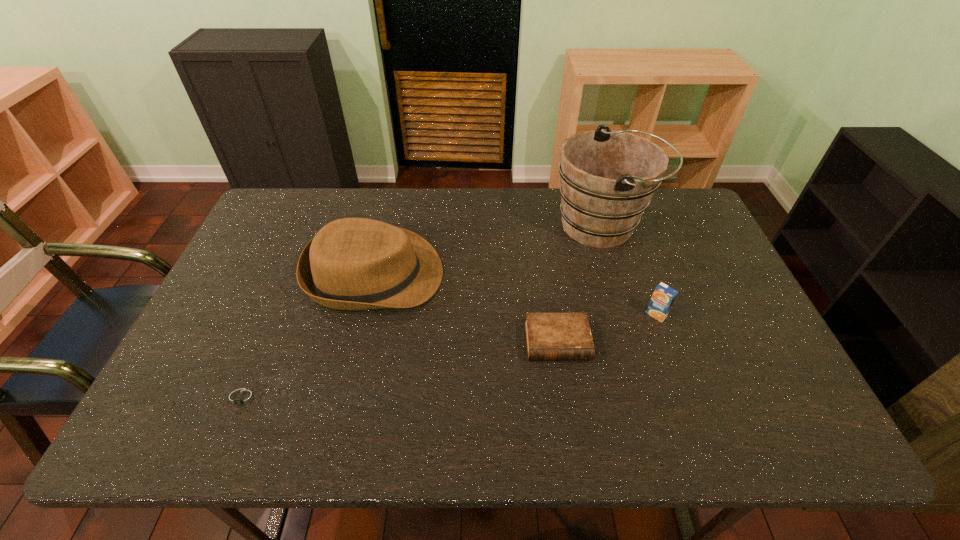
Find the location of `free space between the bucket and the diary`. free space between the bucket and the diary is located at coordinates (580, 284).

Locate an element on the screen. unoccupied position between the orange_juice and the diary is located at coordinates (607, 328).

The width and height of the screenshot is (960, 540). I want to click on blank region between the orange_juice and the fourth shortest object, so click(x=516, y=294).

Locate an element on the screen. Image resolution: width=960 pixels, height=540 pixels. unoccupied position between the diary and the second tallest object is located at coordinates 466,308.

You are a GUI agent. You are given a task and a screenshot of the screen. Output one action in this format:
    pyautogui.click(x=<x>, y=<y>)
    Task: Click on the vacant space in between the diary and the shortest object
    Image resolution: width=960 pixels, height=540 pixels.
    Given the screenshot: What is the action you would take?
    pyautogui.click(x=400, y=370)

At what (x,y) coordinates should I click in order to perform the action: click on the third closest object to the second nearest object. Please return your answer as a coordinate pair (x, y). The width and height of the screenshot is (960, 540). Looking at the image, I should click on (608, 177).

The image size is (960, 540). I want to click on object that stands as the fourth closest to the orange_juice, so click(x=242, y=399).

Where is `free space that satisfies the following two spatial constraints: 1. on the handle side of the tallest object; 2. on the spine side of the second nearest object`? The image size is (960, 540). free space that satisfies the following two spatial constraints: 1. on the handle side of the tallest object; 2. on the spine side of the second nearest object is located at coordinates (637, 342).

Locate an element on the screen. Image resolution: width=960 pixels, height=540 pixels. free space in the image that satisfies the following two spatial constraints: 1. on the handle side of the bucket; 2. on the back side of the orange_juice is located at coordinates (630, 314).

Where is `blank area in the image that satisfies the following two spatial constraints: 1. on the front-facing side of the fedora; 2. on the face of the watch`? blank area in the image that satisfies the following two spatial constraints: 1. on the front-facing side of the fedora; 2. on the face of the watch is located at coordinates (347, 398).